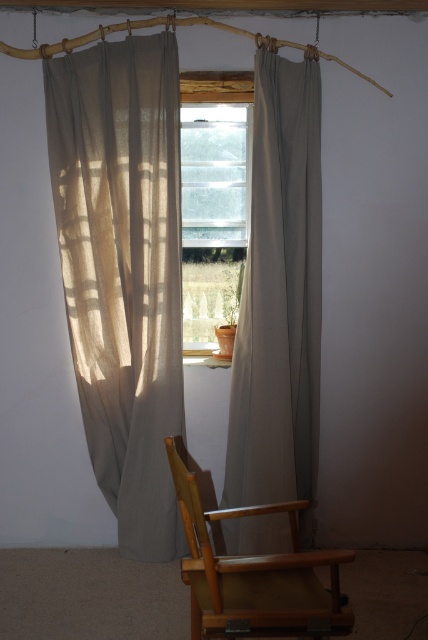
Between sheer beige curtain at left and light brown wooden armchair at lower center, which one has less height?

light brown wooden armchair at lower center

Who is higher up, sheer beige curtain at left or light brown wooden armchair at lower center?

sheer beige curtain at left

Locate an element on the screen. sheer beige curtain at left is located at coordinates (122, 269).

Between sheer fabric curtain at center and clear glass window at center, which one has more height?

With more height is sheer fabric curtain at center.

Does sheer fabric curtain at center have a greater width compared to clear glass window at center?

Correct, the width of sheer fabric curtain at center exceeds that of clear glass window at center.

You are a GUI agent. You are given a task and a screenshot of the screen. Output one action in this format:
    pyautogui.click(x=<x>, y=<y>)
    Task: Click on the sheer fabric curtain at center
    The width and height of the screenshot is (428, 640).
    Given the screenshot: What is the action you would take?
    pyautogui.click(x=279, y=298)

Identify the location of sheer fabric curtain at center. The height and width of the screenshot is (640, 428). (279, 298).

The height and width of the screenshot is (640, 428). What are the coordinates of `sheer beige curtain at left` in the screenshot? It's located at [x=122, y=269].

How much distance is there between sheer beige curtain at left and clear glass window at center?

sheer beige curtain at left is 21.82 inches from clear glass window at center.

Describe the element at coordinates (122, 269) in the screenshot. I see `sheer beige curtain at left` at that location.

The image size is (428, 640). I want to click on sheer beige curtain at left, so click(122, 269).